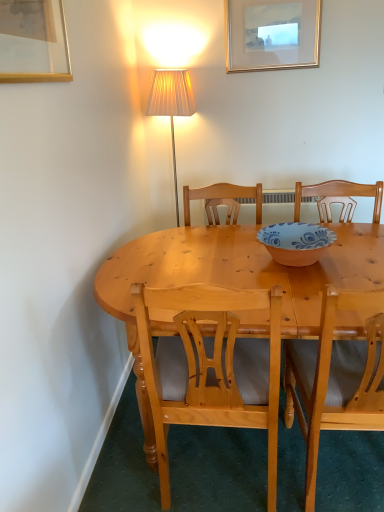
Question: In terms of width, does light wood chair at center, acting as the first chair starting from the left, look wider or thinner when compared to gold metallic picture frame at upper center, which is the 2th picture frame from front to back?

Choices:
 (A) wide
 (B) thin

Answer: (A)

Question: Would you say light wood chair at center, acting as the first chair starting from the left, is inside or outside gold metallic picture frame at upper center, marked as the second picture frame in a left-to-right arrangement?

Choices:
 (A) inside
 (B) outside

Answer: (B)

Question: Which of these objects is positioned farthest from the light wood chair at center, which is the first chair from right to left?

Choices:
 (A) matte orange bowl at center
 (B) gold-framed picture at upper left, the 2th picture frame from the back
 (C) gold metallic picture frame at upper center, marked as the first picture frame in a back-to-front arrangement
 (D) light wood chair at center, which is the 2th chair in right-to-left order

Answer: (C)

Question: Which object is positioned farthest from the gold-framed picture at upper left, the 1th picture frame from the front?

Choices:
 (A) light wood chair at center, which is the first chair from right to left
 (B) gold metallic picture frame at upper center, the first picture frame viewed from the top
 (C) matte orange bowl at center
 (D) light wood chair at center, which is the 2th chair in right-to-left order

Answer: (B)